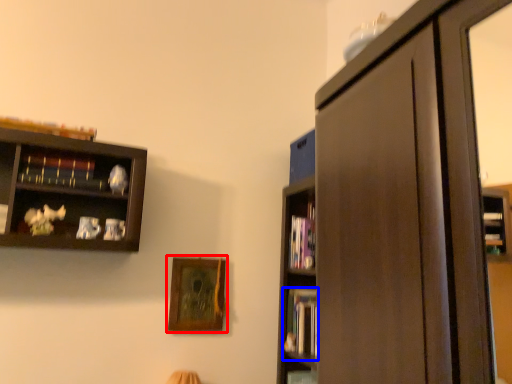
Question: Which point is closer to the camera, picture frame (highlighted by a red box) or book (highlighted by a blue box)?

Choices:
 (A) picture frame
 (B) book

Answer: (A)